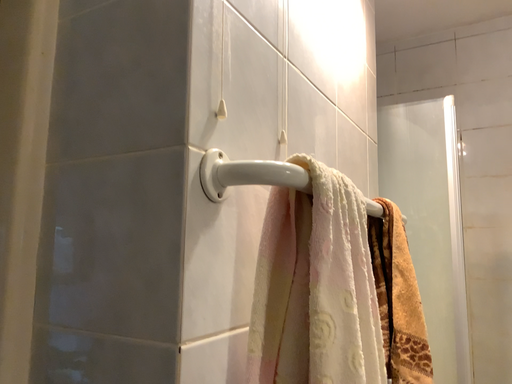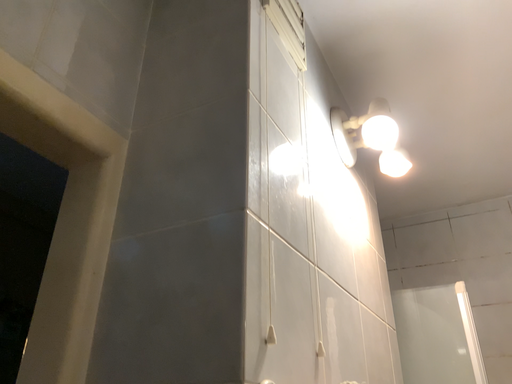
Question: Which way did the camera rotate in the video?

Choices:
 (A) rotated downward
 (B) rotated upward

Answer: (B)